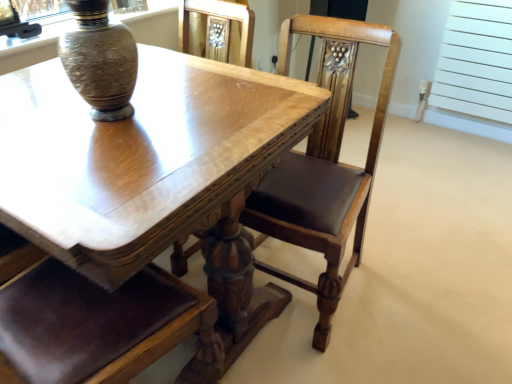
At what (x,y) coordinates should I click in order to perform the action: click on spots to the right of polished wood chair at center. Please return your answer as a coordinate pair (x, y). This screenshot has width=512, height=384. Looking at the image, I should click on (416, 279).